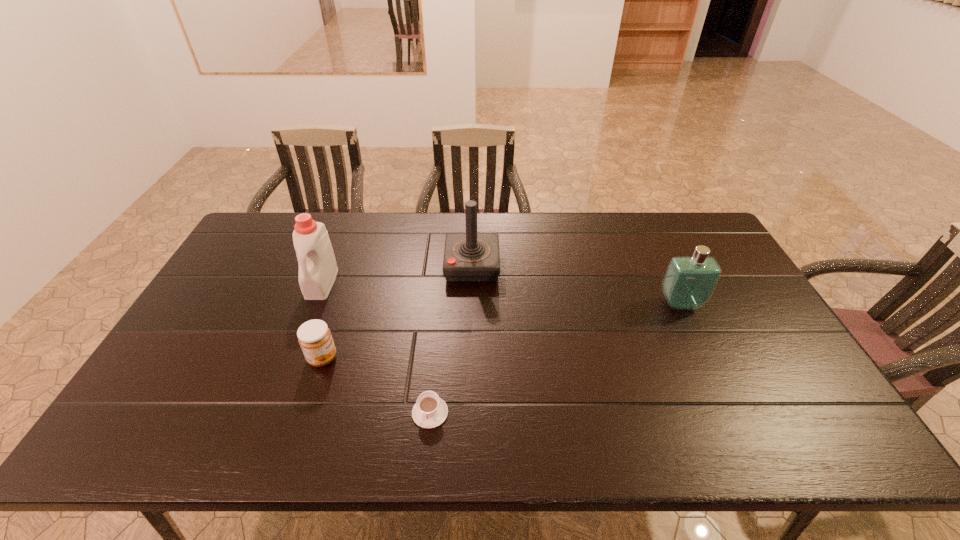
Identify the location of blank space located 0.080m on the front label of the third shortest object. (695, 334).

The height and width of the screenshot is (540, 960). I want to click on vacant region located on the front label of the second nearest object, so click(436, 358).

You are a GUI agent. You are given a task and a screenshot of the screen. Output one action in this format:
    pyautogui.click(x=<x>, y=<y>)
    Task: Click on the object that is at the far edge
    The height and width of the screenshot is (540, 960).
    Given the screenshot: What is the action you would take?
    pyautogui.click(x=471, y=257)

Image resolution: width=960 pixels, height=540 pixels. What are the coordinates of `object located at the near edge` in the screenshot? It's located at (430, 411).

At what (x,y) coordinates should I click in order to perform the action: click on object that is at the right edge. Please return your answer as a coordinate pair (x, y). Looking at the image, I should click on (689, 282).

Find the location of a particular element. The image size is (960, 540). free space at the far edge of the desktop is located at coordinates (651, 232).

This screenshot has width=960, height=540. What are the coordinates of `free region at the near edge of the desktop` in the screenshot? It's located at (684, 426).

Locate an element on the screen. This screenshot has height=540, width=960. vacant region at the left edge of the desktop is located at coordinates (179, 354).

You are a GUI agent. You are given a task and a screenshot of the screen. Output one action in this format:
    pyautogui.click(x=<x>, y=<y>)
    Task: Click on the vacant space at the far left corner
    
    Given the screenshot: What is the action you would take?
    pyautogui.click(x=270, y=217)

Where is `vacant space at the near left corner`? The height and width of the screenshot is (540, 960). vacant space at the near left corner is located at coordinates (132, 440).